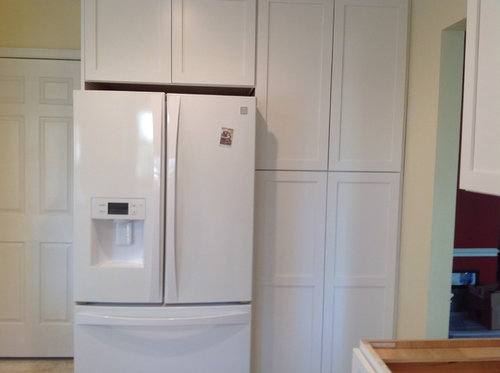
The image size is (500, 373). In order to click on door in this screenshot , I will do `click(37, 196)`.